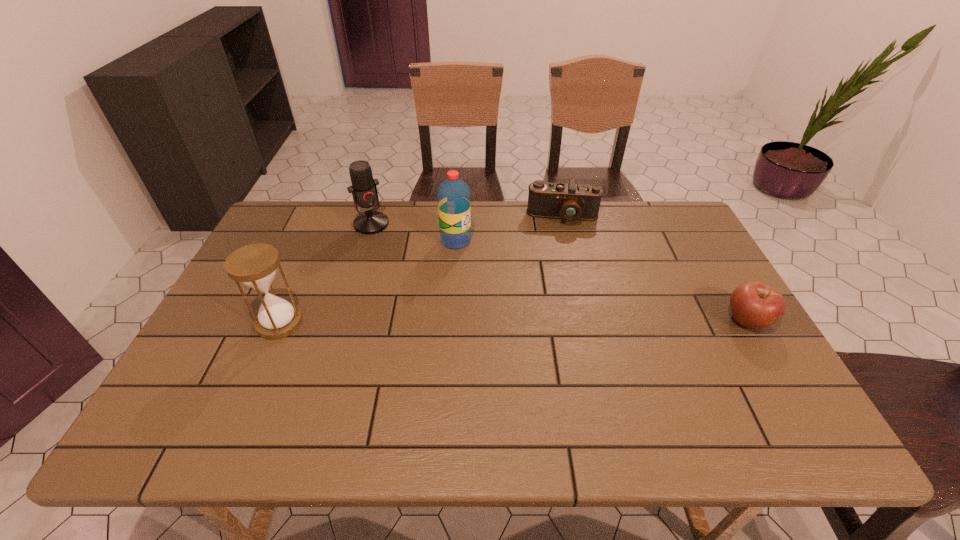
Identify the location of free spot between the microphone and the leftmost object. This screenshot has width=960, height=540. (325, 273).

Where is `empty location between the third object from right to left and the second object from right to left`? Image resolution: width=960 pixels, height=540 pixels. empty location between the third object from right to left and the second object from right to left is located at coordinates (510, 229).

This screenshot has width=960, height=540. What are the coordinates of `vacant area that lies between the rightmost object and the second object from right to left` in the screenshot? It's located at (656, 268).

The height and width of the screenshot is (540, 960). Find the location of `vacant area that lies between the microphone and the shortest object`. vacant area that lies between the microphone and the shortest object is located at coordinates (560, 272).

What are the coordinates of `free space that is in between the second object from right to left and the third object from left to right` in the screenshot? It's located at (510, 229).

Identify the location of free space that is in between the hourglass and the rightmost object. (514, 321).

Identify the location of blank region between the leftmost object and the water bottle. This screenshot has width=960, height=540. (368, 282).

At what (x,y) coordinates should I click in order to perform the action: click on object identified as the second closest to the second object from right to left. Please return your answer as a coordinate pair (x, y). Image resolution: width=960 pixels, height=540 pixels. Looking at the image, I should click on [x=754, y=304].

Identify the location of the fourth closest object to the camera. (254, 265).

Identify the location of vacant space that satisfies the following two spatial constraints: 1. on the back side of the fourth object from right to left; 2. on the left side of the hourglass. (324, 224).